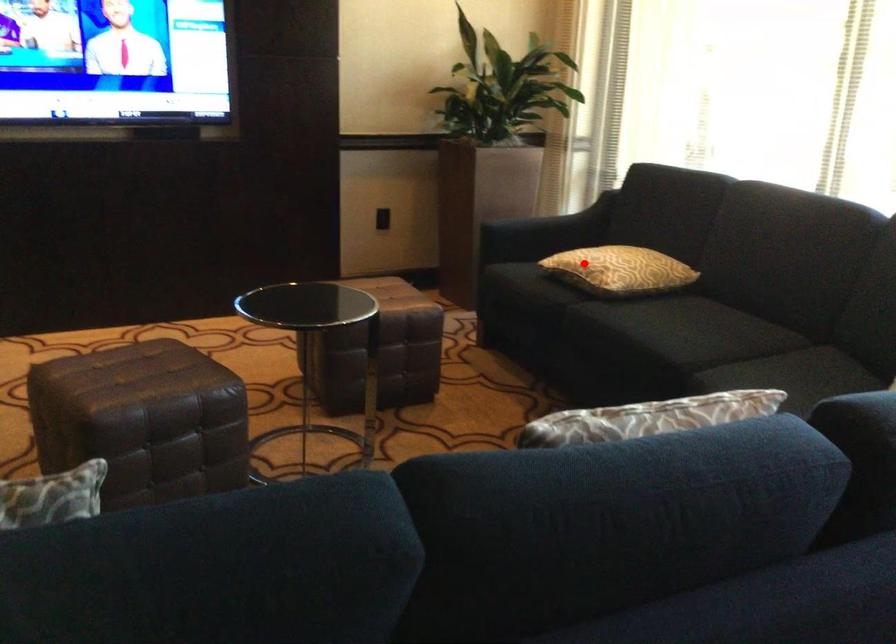
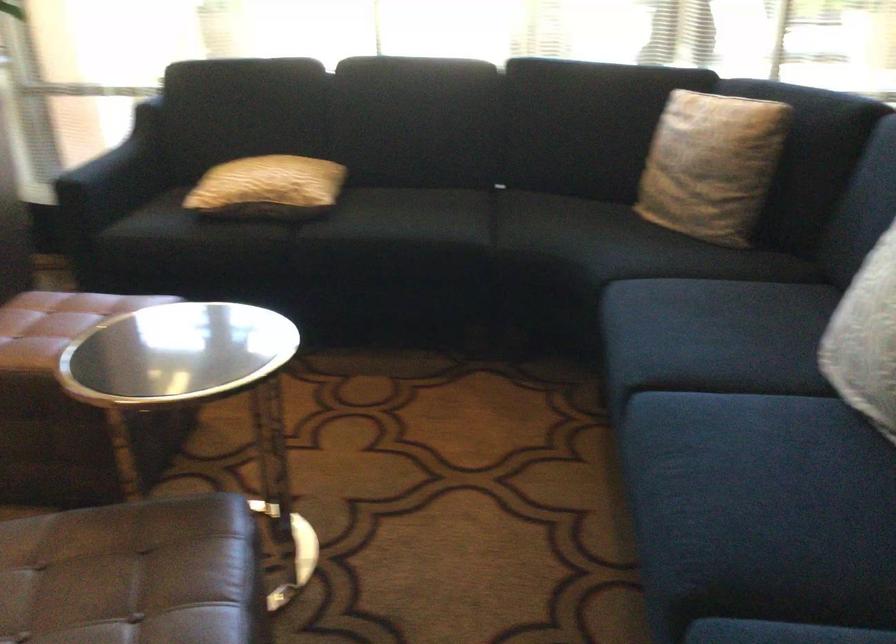
The point at the highlighted location is marked in the first image. Where is the corresponding point in the second image?

(268, 187)